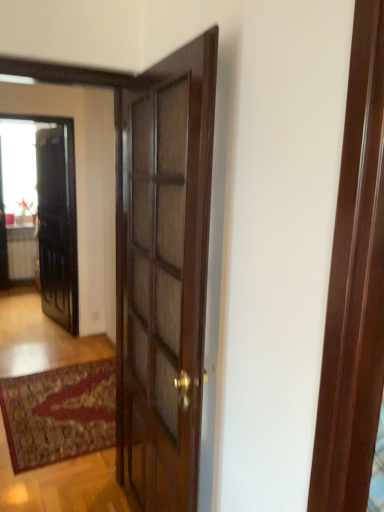
Question: Can you confirm if white glossy radiator at lower left is taller than black glossy elevator at left?

Choices:
 (A) no
 (B) yes

Answer: (A)

Question: From a real-world perspective, is white glossy radiator at lower left physically above black glossy elevator at left?

Choices:
 (A) yes
 (B) no

Answer: (B)

Question: Can we say white glossy radiator at lower left lies outside black glossy elevator at left?

Choices:
 (A) no
 (B) yes

Answer: (B)

Question: Is white glossy radiator at lower left oriented away from black glossy elevator at left?

Choices:
 (A) yes
 (B) no

Answer: (B)

Question: Does white glossy radiator at lower left have a lesser width compared to black glossy elevator at left?

Choices:
 (A) yes
 (B) no

Answer: (B)

Question: From the image's perspective, is white glossy radiator at lower left under black glossy elevator at left?

Choices:
 (A) yes
 (B) no

Answer: (A)

Question: Is glossy dark wood door at center positioned behind transparent glass window at upper left?

Choices:
 (A) no
 (B) yes

Answer: (A)

Question: Is glossy dark wood door at center far from transparent glass window at upper left?

Choices:
 (A) yes
 (B) no

Answer: (B)

Question: Considering the relative sizes of glossy dark wood door at center and transparent glass window at upper left in the image provided, is glossy dark wood door at center thinner than transparent glass window at upper left?

Choices:
 (A) yes
 (B) no

Answer: (B)

Question: Can you confirm if glossy dark wood door at center is positioned to the left of transparent glass window at upper left?

Choices:
 (A) yes
 (B) no

Answer: (B)

Question: From a real-world perspective, is glossy dark wood door at center beneath transparent glass window at upper left?

Choices:
 (A) yes
 (B) no

Answer: (A)

Question: Can you confirm if glossy dark wood door at center is bigger than transparent glass window at upper left?

Choices:
 (A) yes
 (B) no

Answer: (A)

Question: Does black glossy elevator at left have a smaller size compared to transparent glass window at upper left?

Choices:
 (A) no
 (B) yes

Answer: (A)